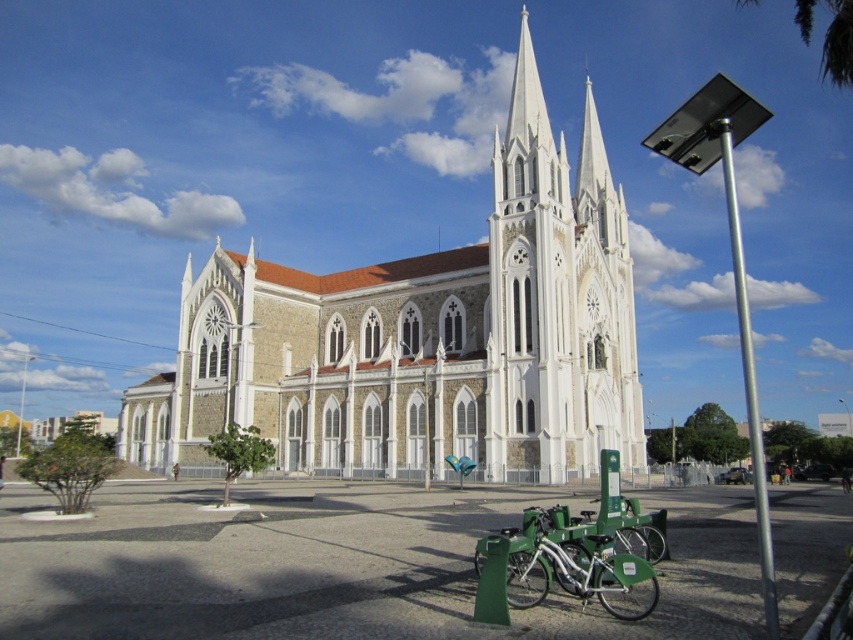
Based on the photo, can you confirm if silver metallic pole at right is smaller than green matte bicycle at lower center?

Actually, silver metallic pole at right might be larger than green matte bicycle at lower center.

Can you confirm if silver metallic pole at right is thinner than green matte bicycle at lower center?

No.

Does point (753, 417) lie behind point (567, 524)?

That is True.

Where is `silver metallic pole at right`? The height and width of the screenshot is (640, 853). silver metallic pole at right is located at coordinates (749, 385).

Does white stone church at center appear under silver metallic pole at right?

Actually, white stone church at center is above silver metallic pole at right.

Does white stone church at center have a lesser height compared to silver metallic pole at right?

In fact, white stone church at center may be taller than silver metallic pole at right.

I want to click on white stone church at center, so click(x=422, y=337).

Who is taller, white stone church at center or green matte bicycle at lower center?

white stone church at center is taller.

Which is more to the right, white stone church at center or green matte bicycle at lower center?

green matte bicycle at lower center is more to the right.

Is point (527, 45) positioned after point (624, 506)?

Yes, point (527, 45) is farther from viewer.

Where is `white stone church at center`? The image size is (853, 640). white stone church at center is located at coordinates (422, 337).